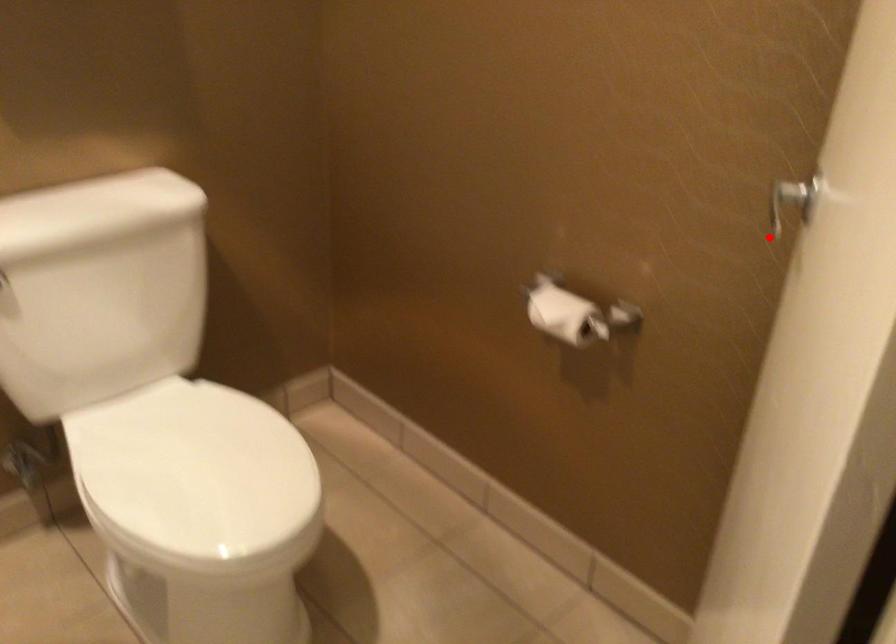
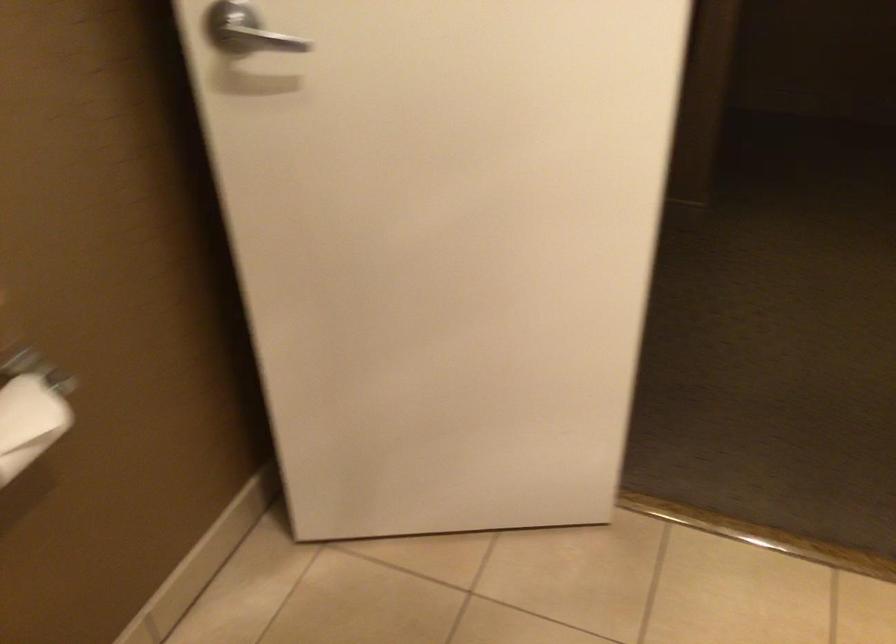
Question: I am providing you with two images of the same scene from different viewpoints. A red point is marked on the first image. At the location where the point appears in image 1, is it still visible in image 2?

Choices:
 (A) Yes
 (B) No

Answer: (A)